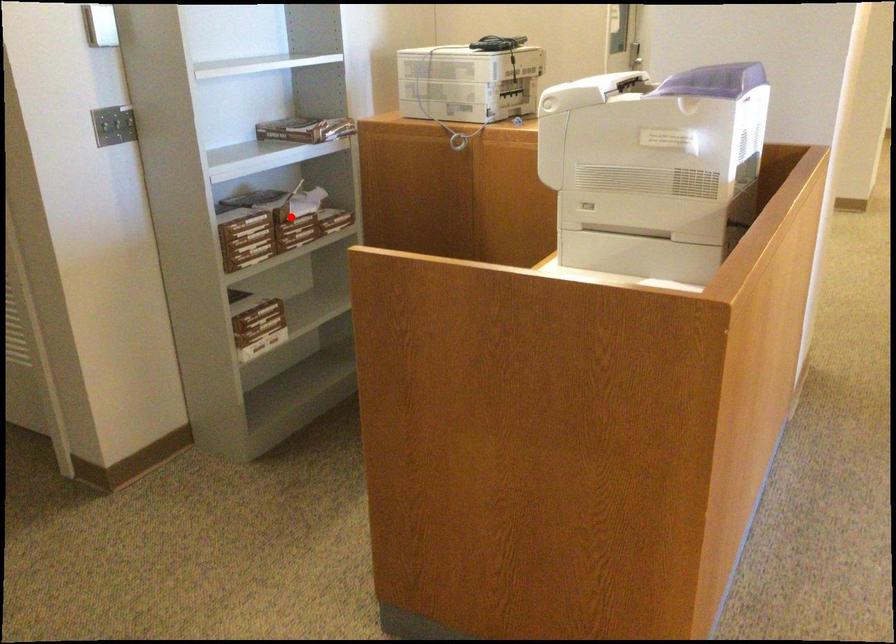
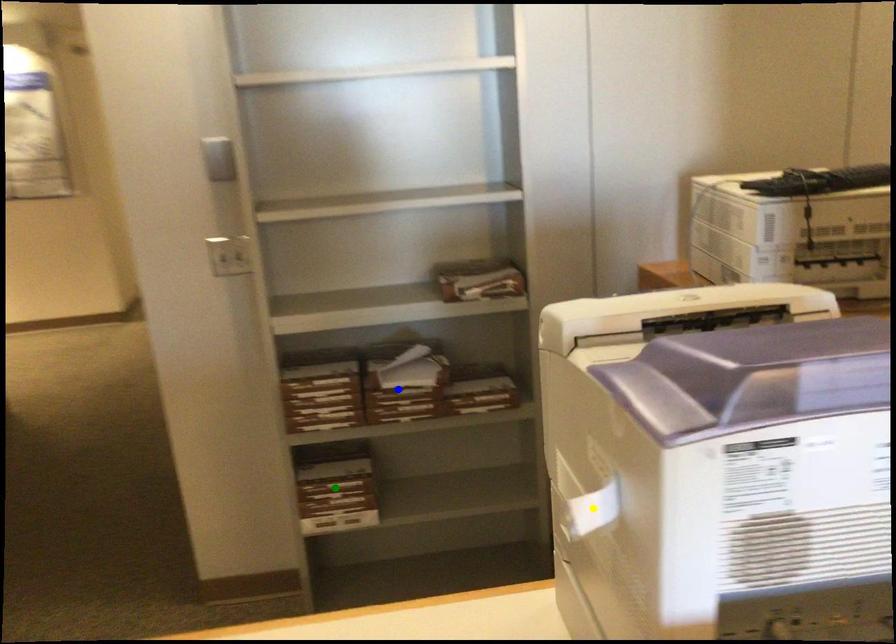
Question: I am providing you with two images of the same scene from different viewpoints. A red point is marked on the first image. You are given multiple points on the second image. Which mark in image 2 goes with the point in image 1?

Choices:
 (A) yellow point
 (B) green point
 (C) blue point

Answer: (C)